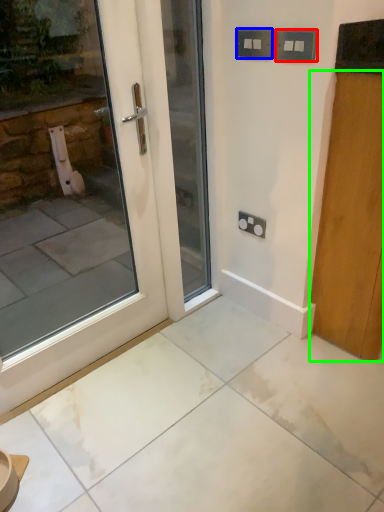
Question: Based on their relative distances, which object is farther from electric outlet (highlighted by a red box)? Choose from electric outlet (highlighted by a blue box) and door (highlighted by a green box).

Choices:
 (A) electric outlet
 (B) door

Answer: (B)